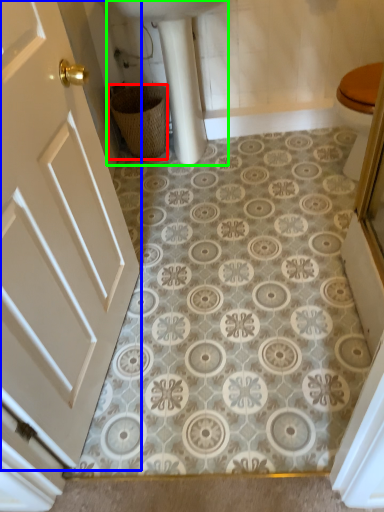
Question: Estimate the real-world distances between objects in this image. Which object is farther from basket (highlighted by a red box), door (highlighted by a blue box) or sink (highlighted by a green box)?

Choices:
 (A) door
 (B) sink

Answer: (A)